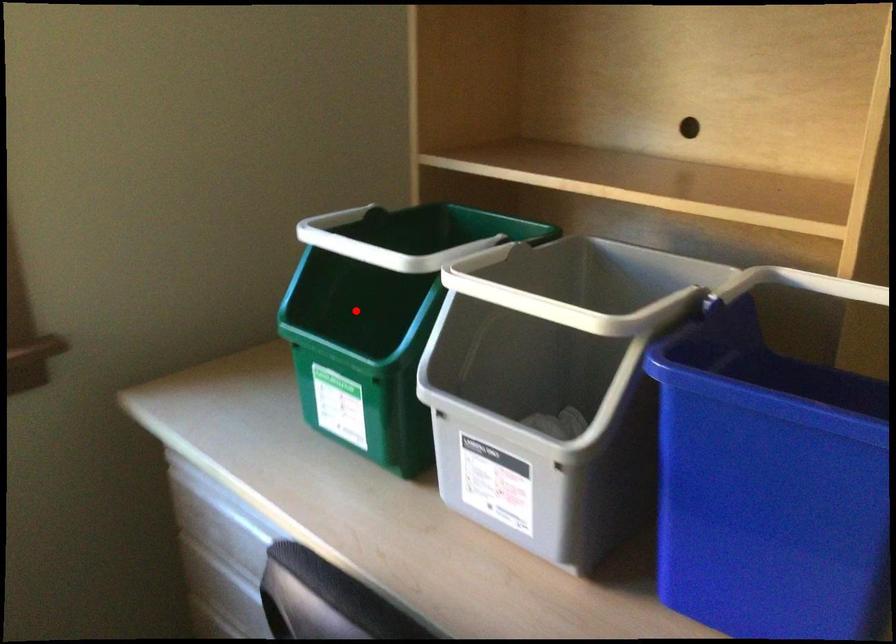
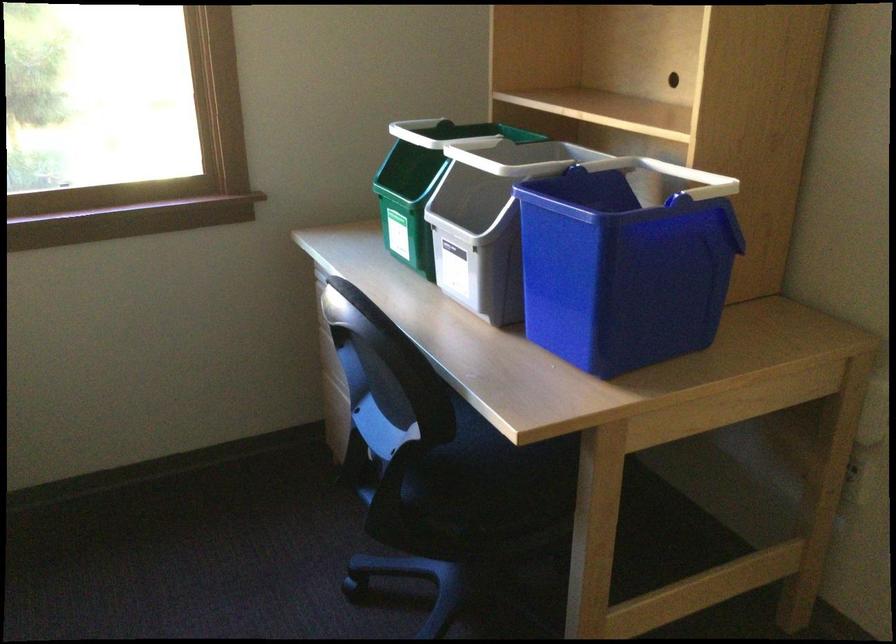
In the second image, find the point that corresponds to the highlighted location in the first image.

(421, 184)